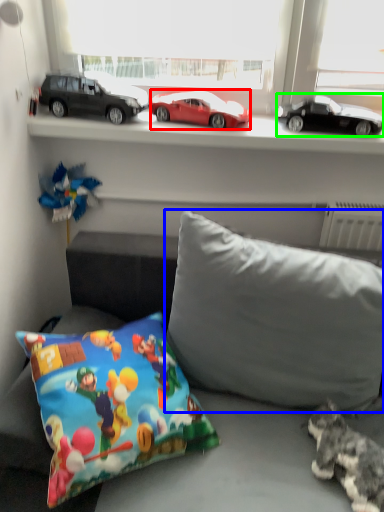
Question: Which is farther away from car (highlighted by a red box)? pillow (highlighted by a blue box) or car (highlighted by a green box)?

Choices:
 (A) pillow
 (B) car

Answer: (A)